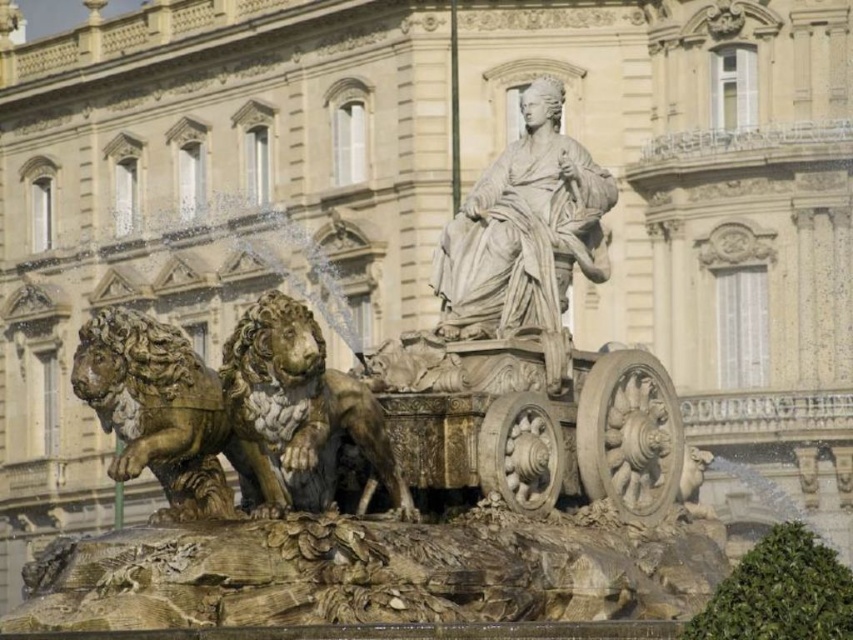
You are standing in front of the fountain and want to place a small flower pot between the two gold polished stone lions. Which lion should you place it closer to, the gold polished stone lion at lower left or the gold polished stone lion at center?

The gold polished stone lion at lower left is to the left of the gold polished stone lion at center. Therefore, placing the flower pot closer to the gold polished stone lion at center would ensure it is between both lions.

You are standing at the point closest to the ornate building in the scene. There are two points marked in the image. Which point, point [132,412] or point [308,364], is farther away from you?

Point [132,412] is behind point [308,364], so it is farther away from you.